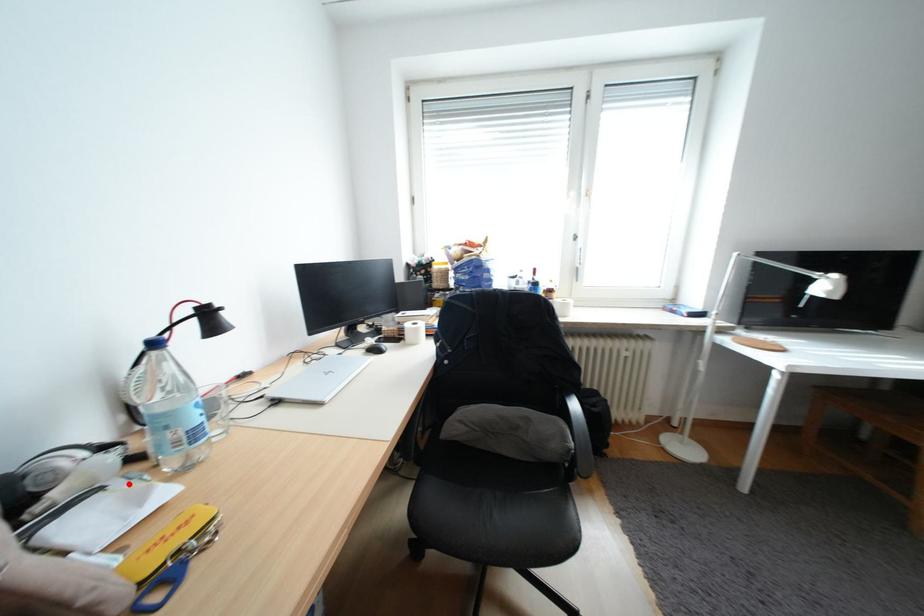
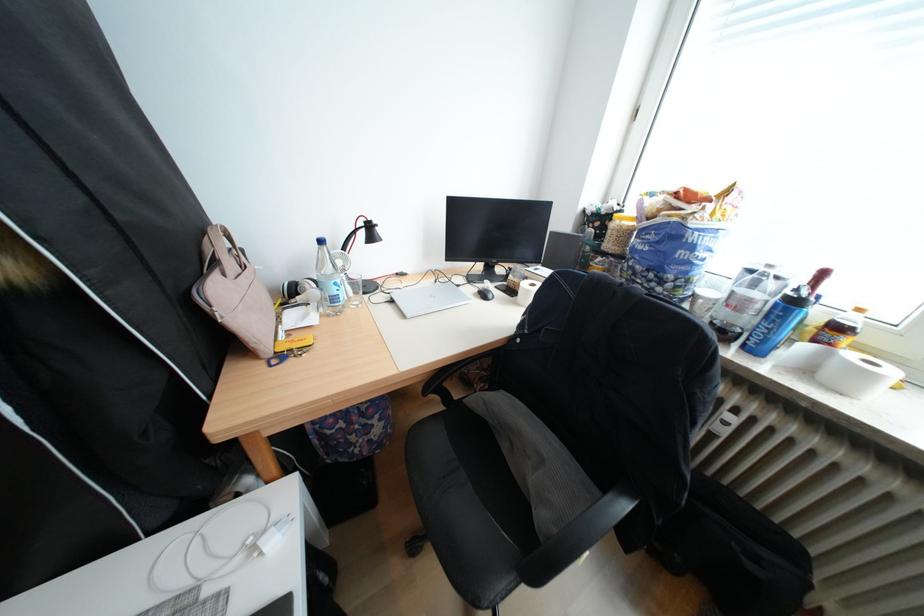
Find the pixel in the second image that matches the highlighted location in the first image.

(325, 306)